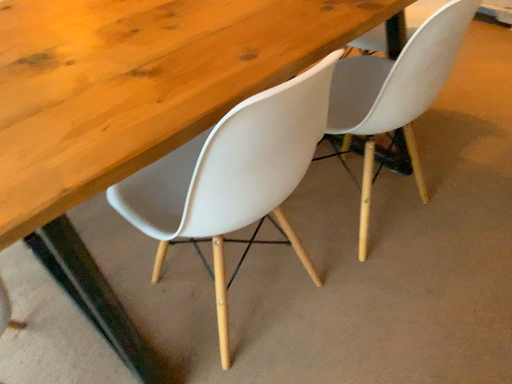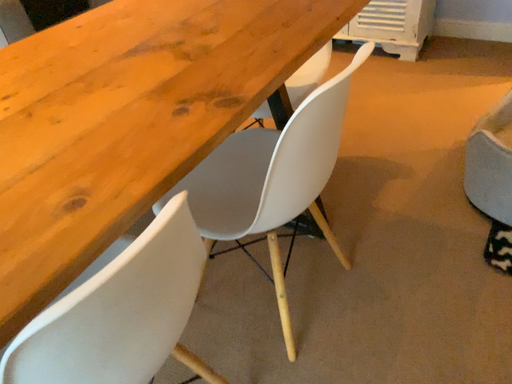
Question: How did the camera likely rotate when shooting the video?

Choices:
 (A) rotated right
 (B) rotated left

Answer: (A)